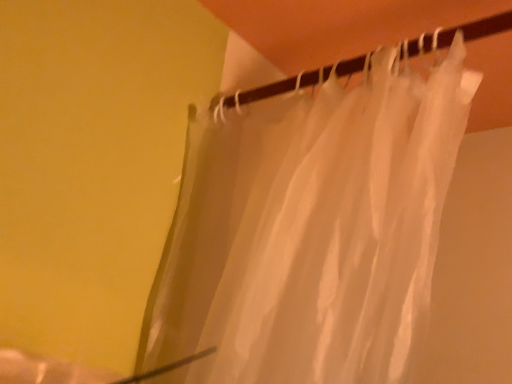
Question: Is translucent fabric at upper center wider or thinner than translucent white curtain at upper center?

Choices:
 (A) thin
 (B) wide

Answer: (A)

Question: Relative to translucent white curtain at upper center, is translucent fabric at upper center in front or behind?

Choices:
 (A) front
 (B) behind

Answer: (B)

Question: From a real-world perspective, is translucent fabric at upper center positioned above or below translucent white curtain at upper center?

Choices:
 (A) below
 (B) above

Answer: (B)

Question: From a real-world perspective, is translucent white curtain at upper center above or below translucent fabric at upper center?

Choices:
 (A) above
 (B) below

Answer: (B)

Question: Is point (282, 145) positioned closer to the camera than point (305, 79)?

Choices:
 (A) farther
 (B) closer

Answer: (B)

Question: In terms of height, does translucent white curtain at upper center look taller or shorter compared to translucent fabric at upper center?

Choices:
 (A) tall
 (B) short

Answer: (A)

Question: Looking at the image, does translucent white curtain at upper center seem bigger or smaller compared to translucent fabric at upper center?

Choices:
 (A) big
 (B) small

Answer: (A)